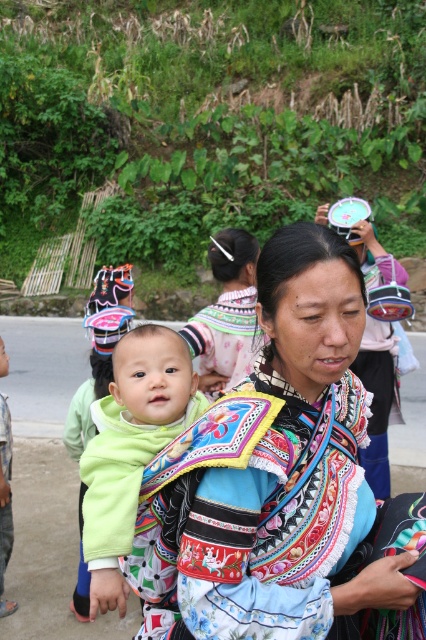
Between embroidered fabric baby carrier at center and green fleece baby at center, which one is positioned higher?

Positioned higher is embroidered fabric baby carrier at center.

Who is more forward, (322,324) or (100,557)?

Point (322,324)

Which is behind, point (386, 596) or point (161, 413)?

The point (161, 413) is more distant.

Locate an element on the screen. embroidered fabric baby carrier at center is located at coordinates (282, 481).